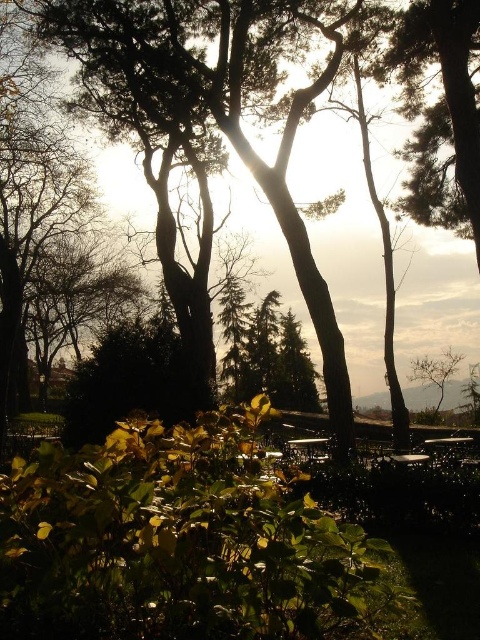
Does green leafy bush at lower center appear on the left side of bare branches at right?

Yes, green leafy bush at lower center is to the left of bare branches at right.

Consider the image. Does green leafy bush at lower center have a greater width compared to bare branches at right?

Correct, the width of green leafy bush at lower center exceeds that of bare branches at right.

Is point (348, 45) less distant than point (418, 378)?

Yes.

Find the location of a particular element. The image size is (480, 640). green leafy bush at lower center is located at coordinates (232, 109).